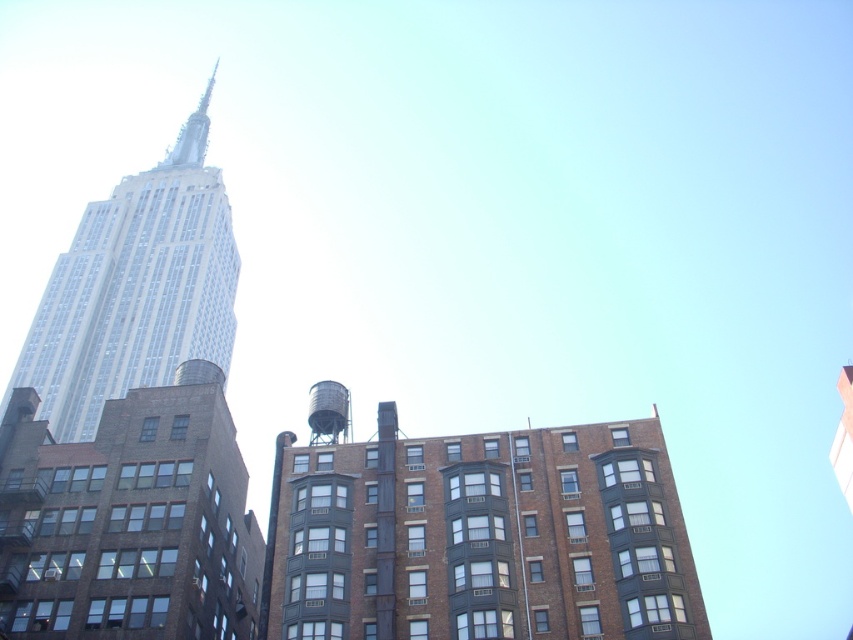
You are standing at the center of the image and want to take a photo of the white glass tower at left. Which direction should you turn to face the tower?

The white glass tower at left is located at point (135, 289), which means it is positioned to the left side of the image. Therefore, you should turn to your left to face the tower.

From the picture: You are a delivery drone with a wingspan of 1.5 meters. You need to fly from the white glass tower at left to the metallic gray water tower at center. Is there enough space between them for your drone to pass through?

The distance between the white glass tower at left and the metallic gray water tower at center is 72.48 meters, which is significantly larger than the drone wingspan of 1.5 meters. Yes, there is enough space for the drone to pass through.

You are an architect planning to install a new antenna on the tallest structure in the image. Which structure should you choose between the white glass tower at left and the metallic gray water tower at center?

The white glass tower at left is larger in size than the metallic gray water tower at center, so you should choose the white glass tower at left to install the new antenna.